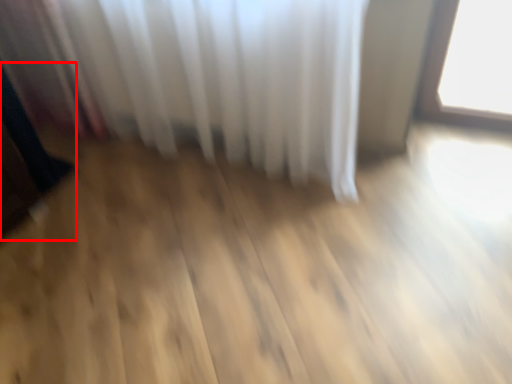
Question: From the image, what is the correct spatial relationship of dark (annotated by the red box) in relation to curtain?

Choices:
 (A) right
 (B) left

Answer: (B)